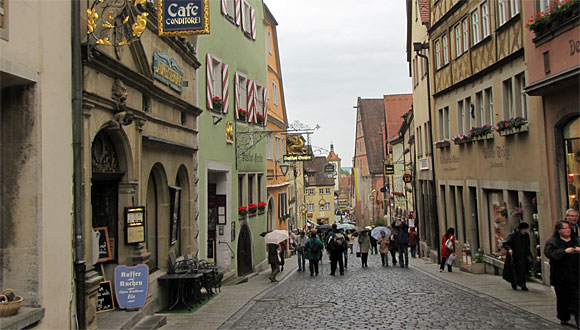
The height and width of the screenshot is (330, 580). I want to click on black chalkboard signs, so click(x=105, y=251), click(x=104, y=295).